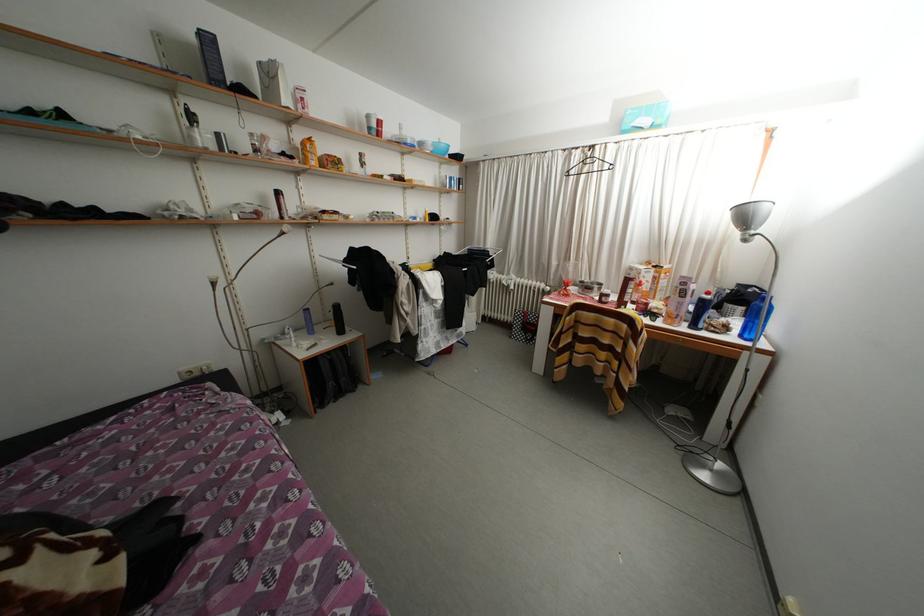
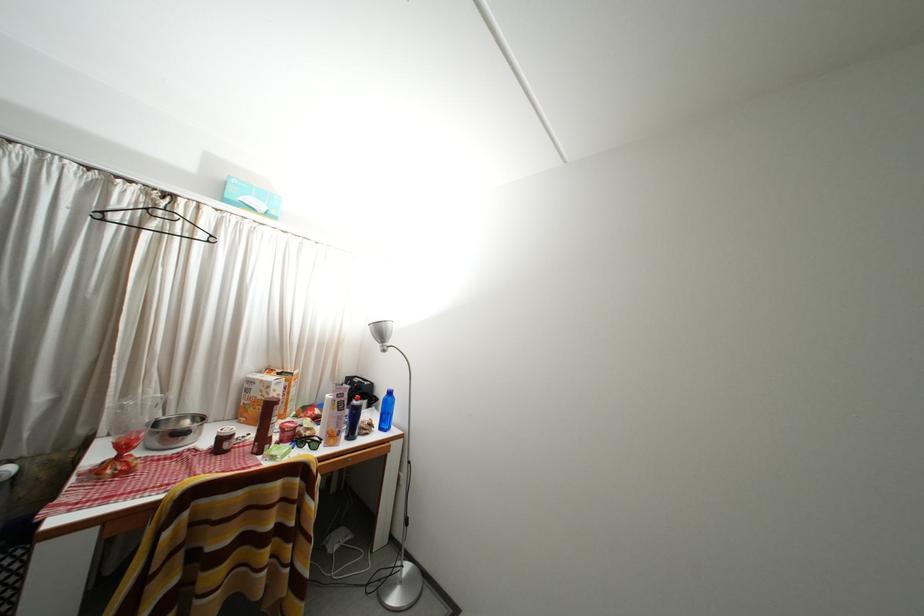
Where in the second image is the point corresponding to [610,301] from the first image?

(229, 445)